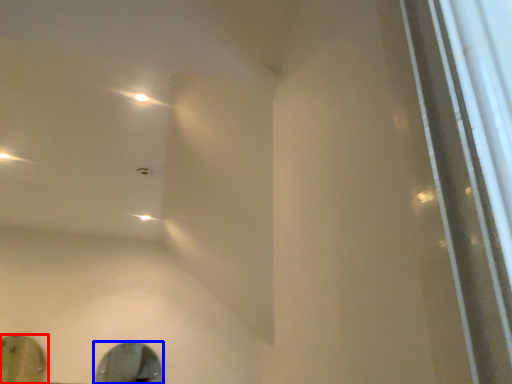
Question: Which object is further to the camera taking this photo, mirror (highlighted by a red box) or mirror (highlighted by a blue box)?

Choices:
 (A) mirror
 (B) mirror

Answer: (B)